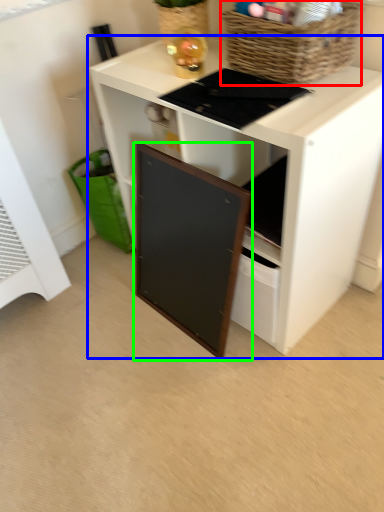
Question: Which is nearer to the basket (highlighted by a red box)? desk (highlighted by a blue box) or cabinetry (highlighted by a green box).

Choices:
 (A) desk
 (B) cabinetry

Answer: (A)